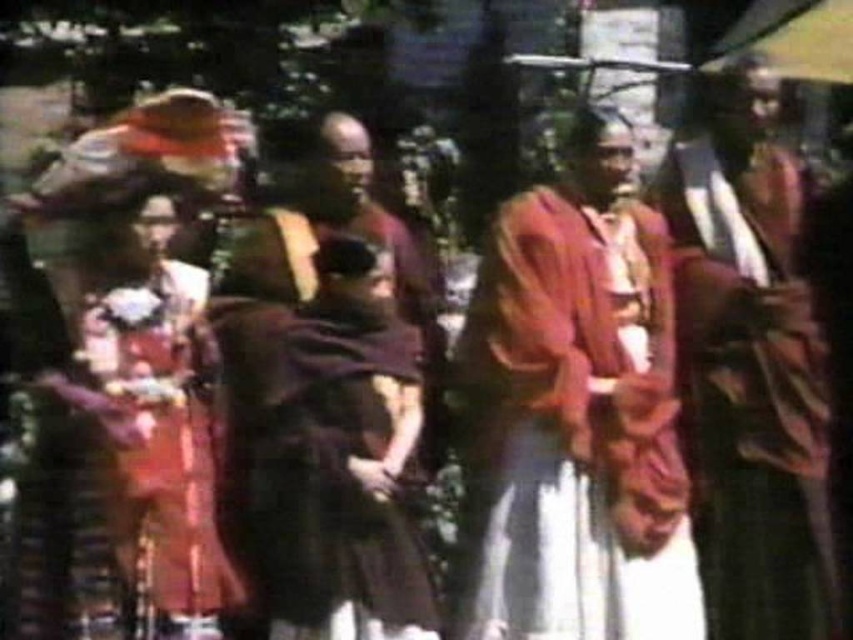
Question: Does matte orange robe at center have a greater width compared to dark brown robe at center?

Choices:
 (A) no
 (B) yes

Answer: (B)

Question: Which point is closer to the camera?

Choices:
 (A) matte orange robe at center
 (B) matte orange dress at left
 (C) dark brown robe at center

Answer: (B)

Question: Among these objects, which one is farthest from the camera?

Choices:
 (A) silky maroon robe at center
 (B) dark brown robe at center
 (C) matte orange robe at center
 (D) matte orange dress at left

Answer: (A)

Question: Can you confirm if dark brown robe at center is thinner than matte orange dress at left?

Choices:
 (A) yes
 (B) no

Answer: (B)

Question: Is dark brown robe at center smaller than silky maroon robe at center?

Choices:
 (A) yes
 (B) no

Answer: (B)

Question: Among these points, which one is farthest from the camera?

Choices:
 (A) (672, 148)
 (B) (154, 484)
 (C) (616, 300)

Answer: (A)